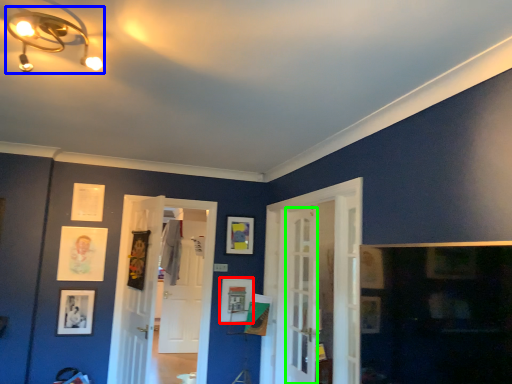
Question: Considering the real-world distances, which object is farthest from picture frame (highlighted by a red box)? light fixture (highlighted by a blue box) or screen door (highlighted by a green box)?

Choices:
 (A) light fixture
 (B) screen door

Answer: (A)